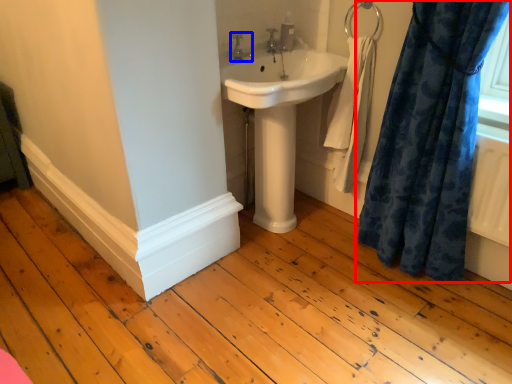
Question: Among these objects, which one is farthest to the camera, curtain (highlighted by a red box) or tap (highlighted by a blue box)?

Choices:
 (A) curtain
 (B) tap

Answer: (B)